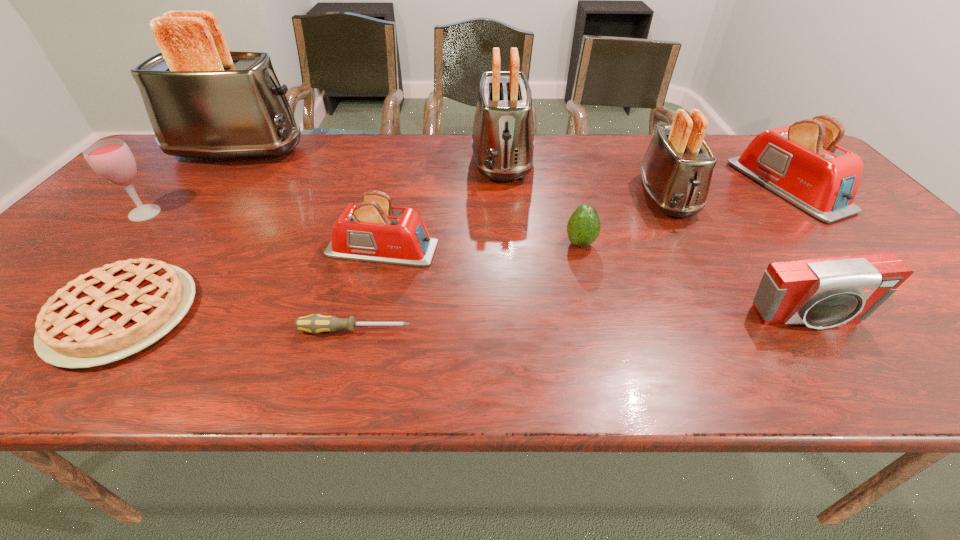
Where is `wineglass that is at the left edge`? The height and width of the screenshot is (540, 960). wineglass that is at the left edge is located at coordinates (111, 159).

Where is `pie present at the left edge`? The width and height of the screenshot is (960, 540). pie present at the left edge is located at coordinates (114, 311).

The width and height of the screenshot is (960, 540). I want to click on object that is at the right edge, so click(x=800, y=162).

Find the location of a particular element. object that is at the far left corner is located at coordinates (202, 100).

The image size is (960, 540). In order to click on object located at the near left corner in this screenshot , I will do `click(114, 311)`.

The height and width of the screenshot is (540, 960). I want to click on object situated at the far right corner, so click(800, 162).

You are a GUI agent. You are given a task and a screenshot of the screen. Output one action in this format:
    pyautogui.click(x=<x>, y=<y>)
    Task: Click on the free space at the far edge of the desktop
    The image size is (960, 540).
    Given the screenshot: What is the action you would take?
    pyautogui.click(x=473, y=167)

Image resolution: width=960 pixels, height=540 pixels. In the image, there is a desktop. Identify the location of free space at the near edge. (726, 368).

You are a GUI agent. You are given a task and a screenshot of the screen. Output one action in this format:
    pyautogui.click(x=<x>, y=<y>)
    Task: Click on the blank space at the left edge
    This screenshot has height=540, width=960.
    Given the screenshot: What is the action you would take?
    pyautogui.click(x=90, y=246)

In the image, there is a desktop. Identify the location of vacant space at the right edge. (819, 229).